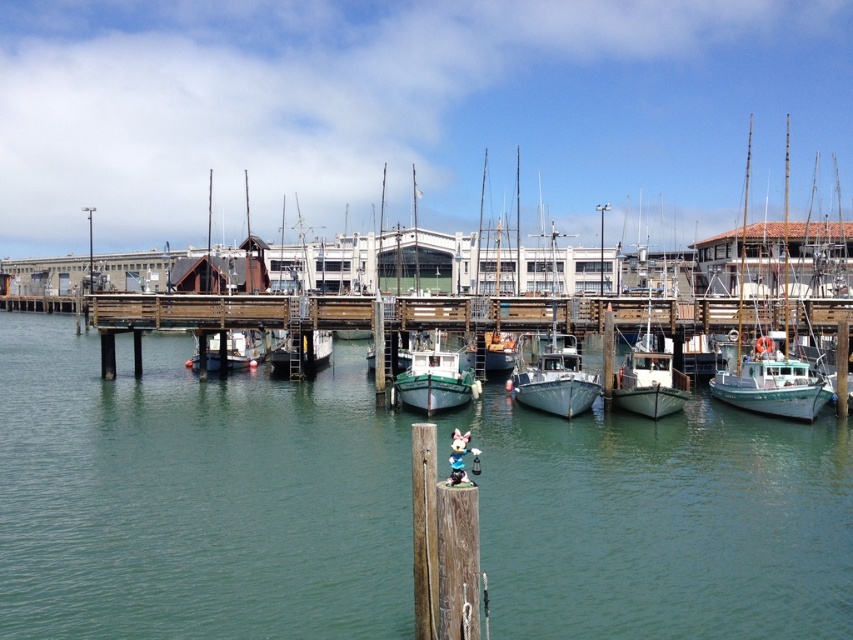
Is wooden dock at center smaller than white wooden boat at center?

Incorrect, wooden dock at center is not smaller in size than white wooden boat at center.

Does wooden dock at center appear on the left side of white wooden boat at center?

Yes, wooden dock at center is to the left of white wooden boat at center.

The height and width of the screenshot is (640, 853). I want to click on wooden dock at center, so click(x=161, y=308).

The image size is (853, 640). Identify the location of wooden dock at center. (161, 308).

Measure the distance from teal matte boat at right to white wooden boat at center.

They are 197.79 feet apart.

Who is shorter, teal matte boat at right or white wooden boat at center?

Standing shorter between the two is white wooden boat at center.

I want to click on teal matte boat at right, so click(770, 353).

Does teal matte boat at right appear under green matte boat at center?

Incorrect, teal matte boat at right is not positioned below green matte boat at center.

This screenshot has height=640, width=853. What do you see at coordinates (770, 353) in the screenshot? I see `teal matte boat at right` at bounding box center [770, 353].

The width and height of the screenshot is (853, 640). In order to click on teal matte boat at right in this screenshot , I will do `click(770, 353)`.

I want to click on teal matte boat at right, so click(x=770, y=353).